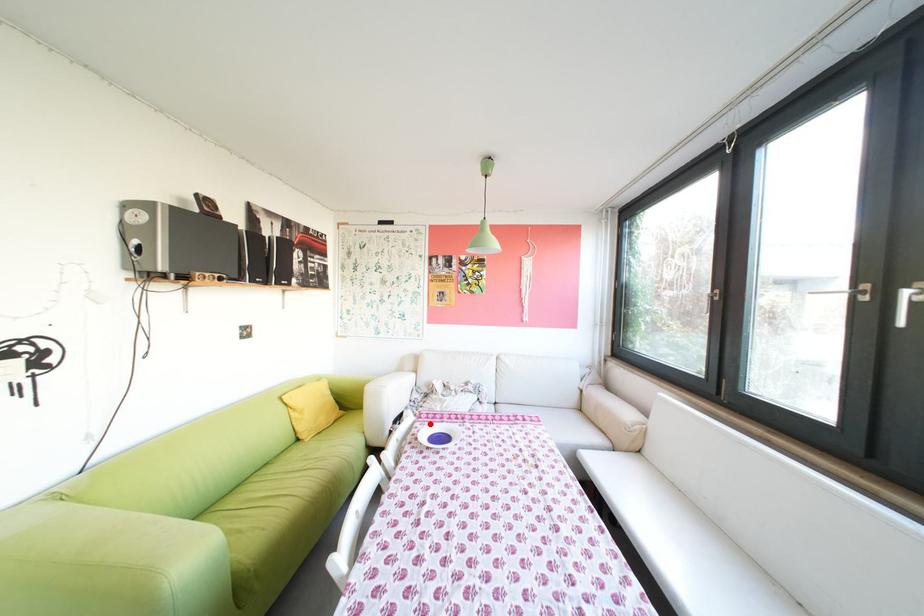
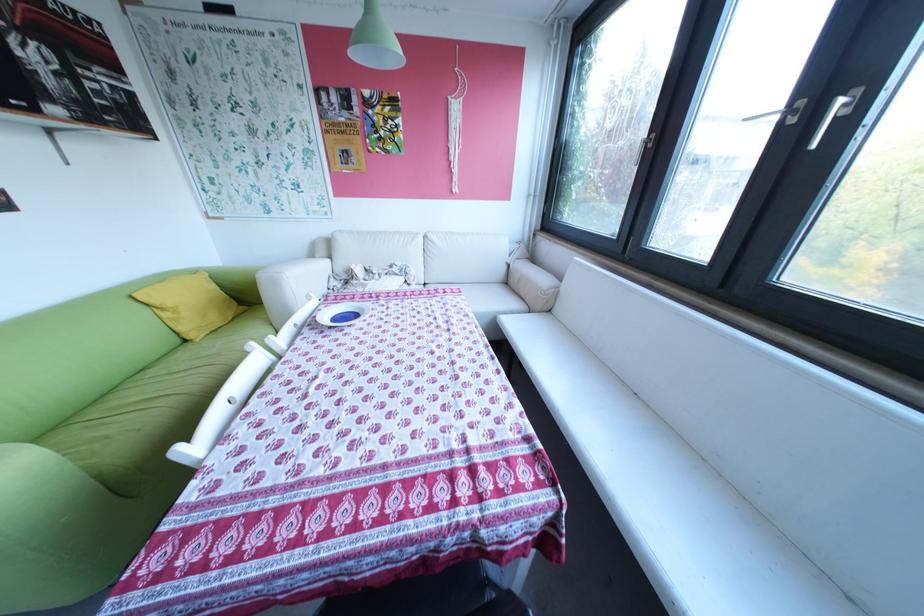
Where in the second image is the point corresponding to the highlighted location from the first image?

(334, 307)